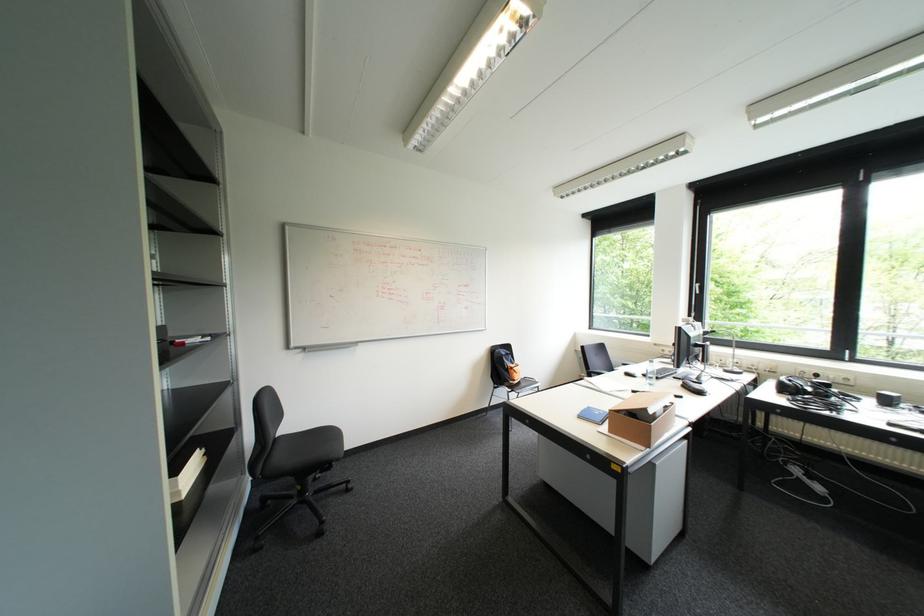
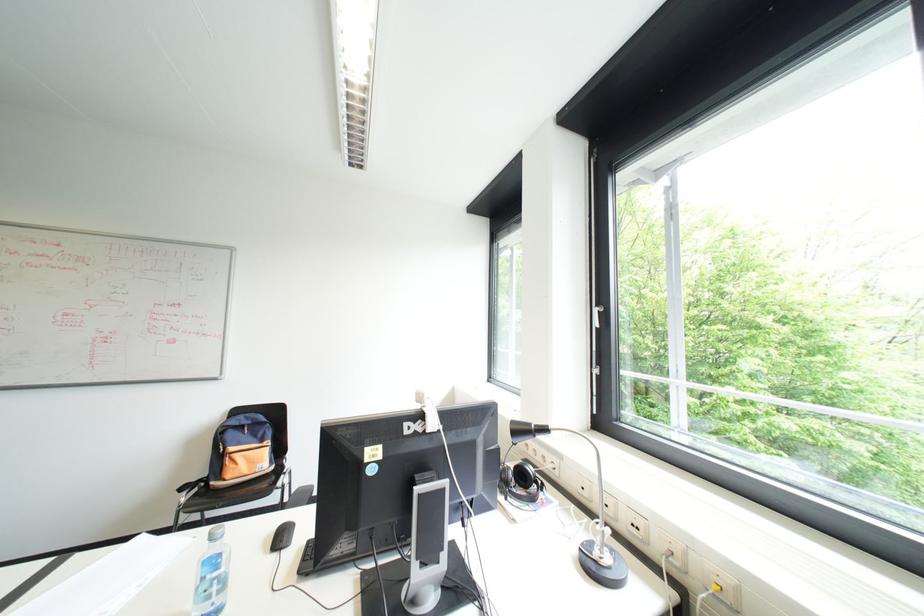
In a continuous first-person perspective shot, in which direction is the camera moving?

The movement direction of the cameraman is right, forward.